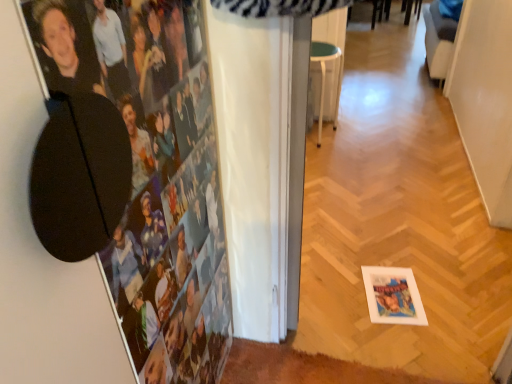
Question: From the image's perspective, is white plastic stool at center above or below fabric swivel chair at upper right?

Choices:
 (A) above
 (B) below

Answer: (B)

Question: Relative to fabric swivel chair at upper right, is white plastic stool at center in front or behind?

Choices:
 (A) behind
 (B) front

Answer: (B)

Question: Which object is positioned farthest from the white plastic stool at center?

Choices:
 (A) black matte photo frame at upper left
 (B) fabric swivel chair at upper right

Answer: (A)

Question: Estimate the real-world distances between objects in this image. Which object is farther from the black matte photo frame at upper left?

Choices:
 (A) white plastic stool at center
 (B) fabric swivel chair at upper right

Answer: (B)